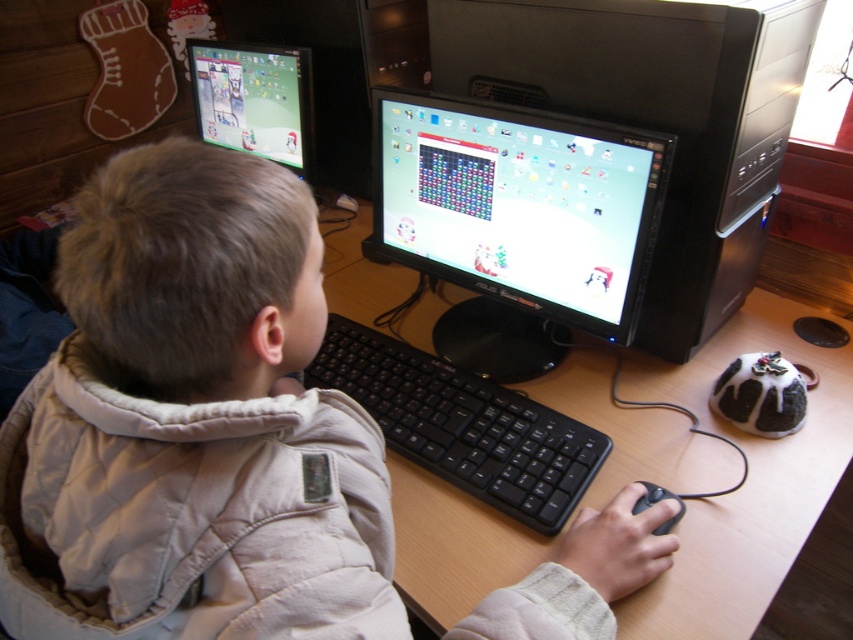
Is wooden at center in front of matte plastic monitor at upper left?

That is True.

How distant is wooden at center from matte plastic monitor at upper left?

wooden at center and matte plastic monitor at upper left are 19.19 inches apart from each other.

Is point (825, 397) positioned in front of point (244, 134)?

Yes, point (825, 397) is closer to viewer.

Locate an element on the screen. wooden at center is located at coordinates (746, 481).

Can you confirm if black plastic keyboard at center is positioned below black matte mouse at lower right?

Actually, black plastic keyboard at center is above black matte mouse at lower right.

The image size is (853, 640). Find the location of `black plastic keyboard at center`. black plastic keyboard at center is located at coordinates 463,424.

Between point (415, 356) and point (648, 500), which one is positioned behind?

Point (415, 356)

The width and height of the screenshot is (853, 640). I want to click on black plastic keyboard at center, so click(463, 424).

Does point (311, 545) lie in front of point (743, 596)?

That is True.

Does point (233, 241) lie in front of point (795, 451)?

Yes, point (233, 241) is closer to viewer.

What are the coordinates of `beige quilted jacket at center` in the screenshot? It's located at [192, 424].